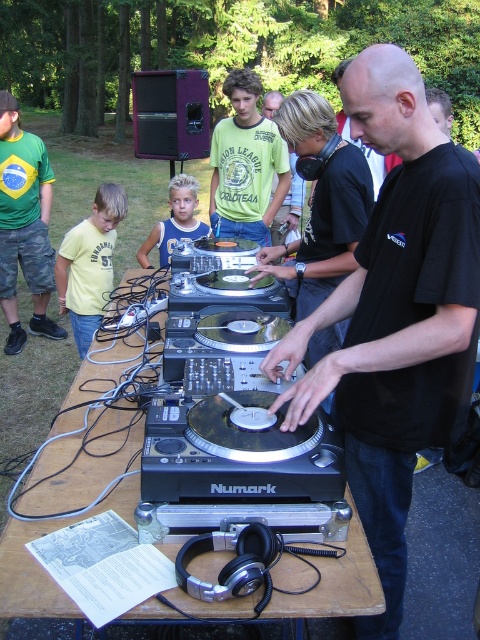
Can you confirm if black matte shirt at center is shorter than green matte shirt at center?

No, black matte shirt at center is not shorter than green matte shirt at center.

The image size is (480, 640). What do you see at coordinates (396, 314) in the screenshot? I see `black matte shirt at center` at bounding box center [396, 314].

Where is `black matte shirt at center`? Image resolution: width=480 pixels, height=640 pixels. black matte shirt at center is located at coordinates (396, 314).

At what (x,y) coordinates should I click in order to perform the action: click on black matte shirt at center. Please return your answer as a coordinate pair (x, y). Looking at the image, I should click on (396, 314).

Between black matte shirt at center and green jersey at left, which one appears on the right side from the viewer's perspective?

black matte shirt at center is more to the right.

Image resolution: width=480 pixels, height=640 pixels. What do you see at coordinates (396, 314) in the screenshot?
I see `black matte shirt at center` at bounding box center [396, 314].

Find the location of `black matte shirt at center`. black matte shirt at center is located at coordinates (396, 314).

You are a GUI agent. You are given a task and a screenshot of the screen. Output one action in this format:
    pyautogui.click(x=<x>, y=<y>)
    Task: Click on the black matte shirt at center
    
    Given the screenshot: What is the action you would take?
    pyautogui.click(x=396, y=314)

Does black matte shirt at center appear under wooden table at center?

No, black matte shirt at center is not below wooden table at center.

At what (x,y) coordinates should I click in order to perform the action: click on black matte shirt at center. Please return your answer as a coordinate pair (x, y). The image size is (480, 640). Looking at the image, I should click on (396, 314).